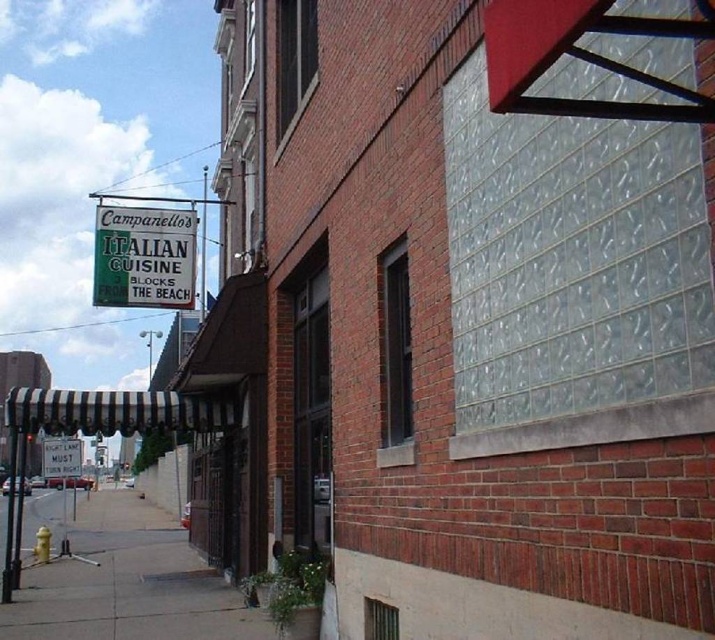
Question: Which is nearer to the gray concrete sidewalk at lower left?

Choices:
 (A) white plastic sign at lower left
 (B) green paper sign at upper left

Answer: (A)

Question: Which object is positioned closest to the green paper sign at upper left?

Choices:
 (A) gray concrete sidewalk at lower left
 (B) white plastic sign at lower left

Answer: (B)

Question: Does gray concrete sidewalk at lower left have a lesser width compared to green paper sign at upper left?

Choices:
 (A) no
 (B) yes

Answer: (A)

Question: Is green paper sign at upper left behind white plastic sign at lower left?

Choices:
 (A) yes
 (B) no

Answer: (B)

Question: Among these objects, which one is nearest to the camera?

Choices:
 (A) green paper sign at upper left
 (B) gray concrete sidewalk at lower left
 (C) white plastic sign at lower left

Answer: (B)

Question: Is gray concrete sidewalk at lower left to the left of white plastic sign at lower left from the viewer's perspective?

Choices:
 (A) no
 (B) yes

Answer: (A)